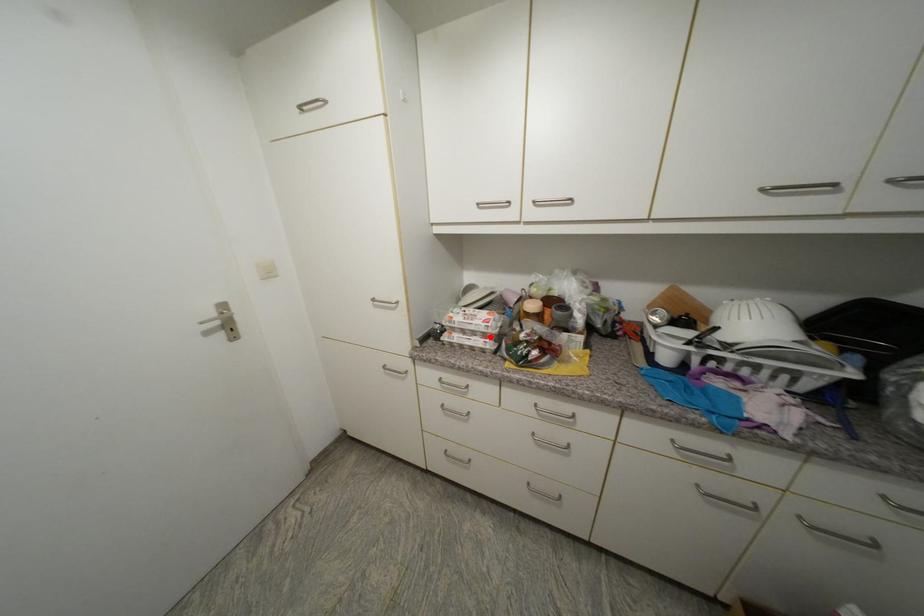
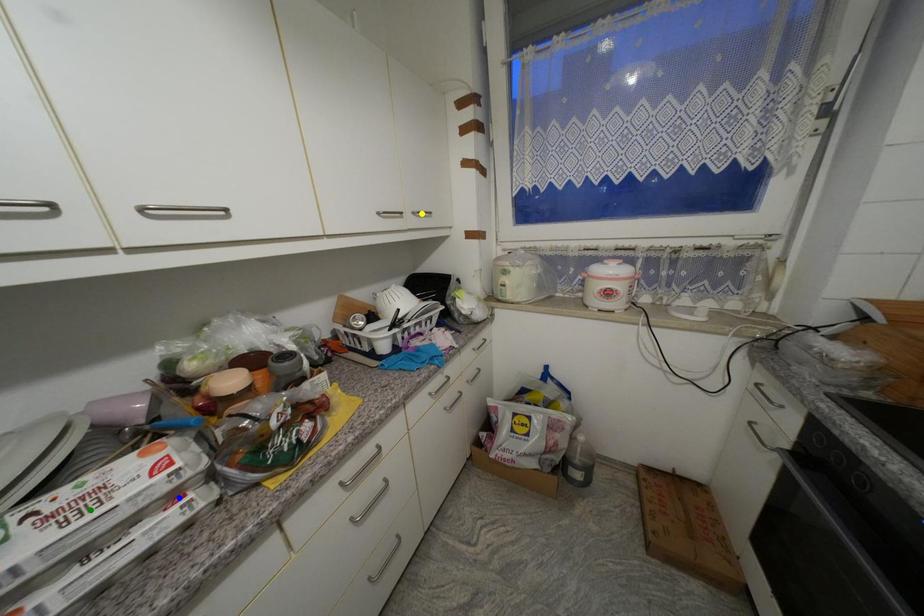
Question: I am providing you with two images of the same scene from different viewpoints. A red point is marked on the first image. You are given multiple points on the second image. Which mark in image 2 goes with the point in image 1?

Choices:
 (A) yellow point
 (B) green point
 (C) blue point

Answer: (C)